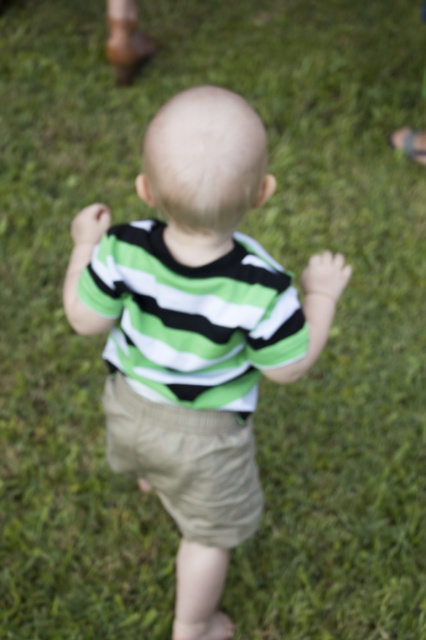
Can you confirm if green striped shirt at center is shorter than khaki cotton shorts at center?

No, green striped shirt at center is not shorter than khaki cotton shorts at center.

Is point (221, 364) positioned after point (215, 442)?

No, it is not.

Between point (126, 257) and point (111, 388), which one is positioned behind?

The point (111, 388) is more distant.

Find the location of a particular element. green striped shirt at center is located at coordinates (195, 332).